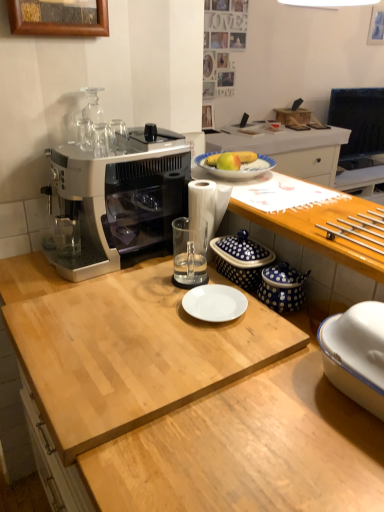
Identify the location of vacant area that is in front of yellow matte apple at center. This screenshot has width=384, height=512. (261, 192).